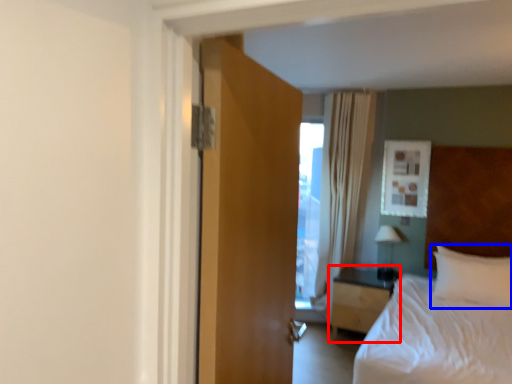
Question: Which object appears closest to the camera in this image, nightstand (highlighted by a red box) or pillow (highlighted by a blue box)?

Choices:
 (A) nightstand
 (B) pillow

Answer: (B)